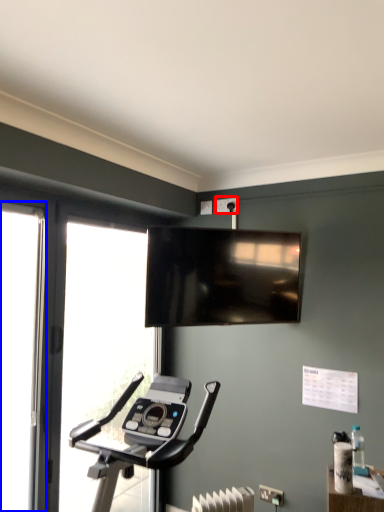
Question: Which object appears farthest to the camera in this image, electric outlet (highlighted by a red box) or screen door (highlighted by a blue box)?

Choices:
 (A) electric outlet
 (B) screen door

Answer: (A)